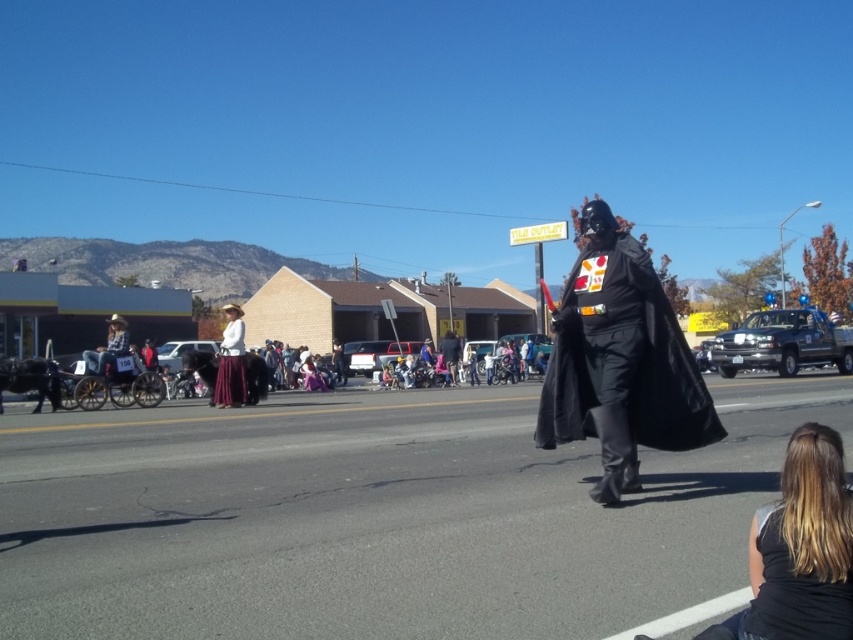
You are a photographer taking pictures of the parade. You see the matte white shirt at center and the matte black costume at center. Which one is more to the right?

The matte white shirt at center is positioned on the right side of matte black costume at center, so the matte white shirt at center is more to the right.

You are a photographer trying to capture both the matte white shirt at center and the matte black costume at center in a single frame. Which object should you focus on first to ensure both are in the frame?

The matte white shirt at center is smaller in size compared to the matte black costume at center. Therefore, you should focus on the matte black costume at center first as it occupies more space in the frame, ensuring both are captured effectively.

You are a photographer trying to capture a photo of the black matte cape at center and the blonde hair at lower right. From your current position, which object should you adjust your camera to focus on first if you want to include both in the frame?

The black matte cape at center is positioned on the right side of blonde hair at lower right, so you should focus on the blonde hair at lower right first to ensure both are in frame.